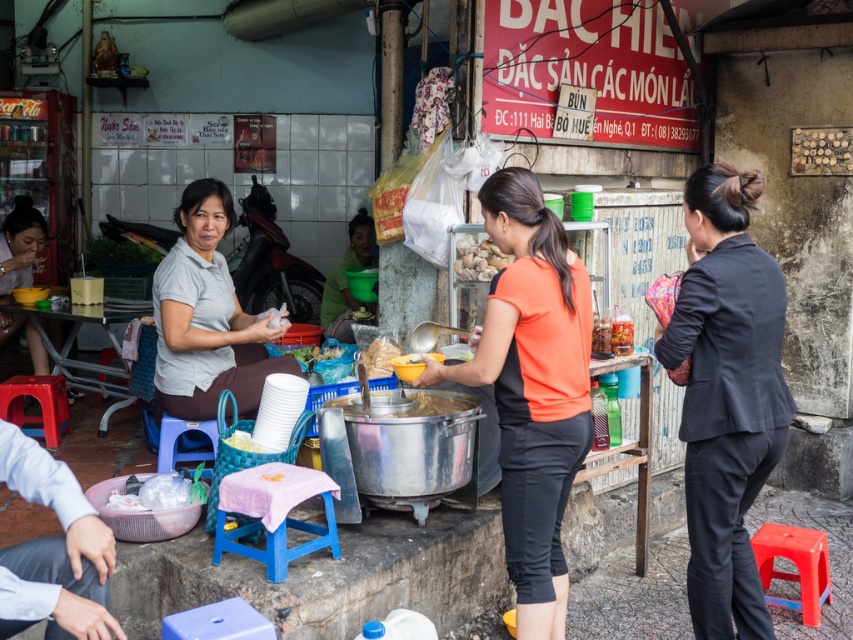
Which is above, green matte bowl at center or yellow matte bowl at center?

green matte bowl at center is higher up.

Does green matte bowl at center have a greater width compared to yellow matte bowl at center?

Correct, the width of green matte bowl at center exceeds that of yellow matte bowl at center.

This screenshot has height=640, width=853. I want to click on green matte bowl at center, so click(x=346, y=278).

This screenshot has width=853, height=640. In order to click on green matte bowl at center in this screenshot , I will do `click(346, 278)`.

Who is more distant from viewer, (728, 412) or (213, 554)?

The point (213, 554) is behind.

Find the location of a particular element. Image resolution: width=853 pixels, height=640 pixels. black fabric suit at right is located at coordinates (726, 394).

Is point (782, 292) positioned in front of point (329, 524)?

Yes, it is.

Find the location of a particular element. This screenshot has width=853, height=640. black fabric suit at right is located at coordinates (726, 394).

Between light gray cotton shirt at center and blue plastic stool at lower left, which one has more height?

With more height is light gray cotton shirt at center.

Consider the image. Who is positioned more to the left, light gray cotton shirt at center or blue plastic stool at lower left?

From the viewer's perspective, blue plastic stool at lower left appears more on the left side.

Who is more distant from viewer, (192,417) or (195,452)?

Point (195,452)

Identify the location of light gray cotton shirt at center. The width and height of the screenshot is (853, 640). [206, 316].